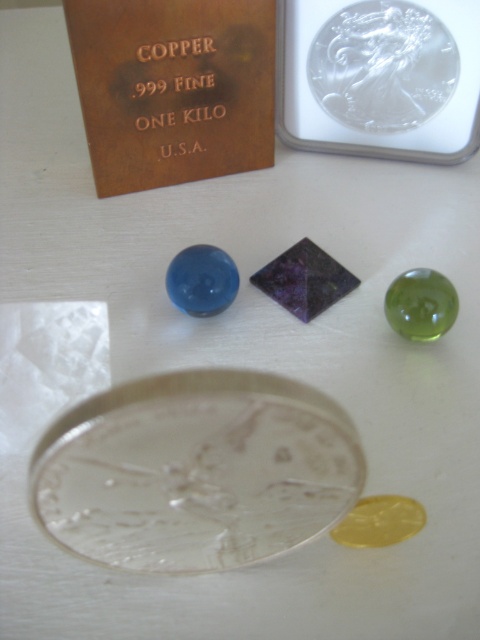
You are an antique dealer inspecting items on a table. You notice the copper metallic plaque at upper left and the clear glass coin at upper center. Which object is wider?

The copper metallic plaque at upper left is wider than the clear glass coin at upper center.

You are standing at point (222,148) and want to pick up an object that is 1.39 meters away from you. Which object can you reach?

The point (222,148) is 1.39 meters away from the viewer, so you can reach it.